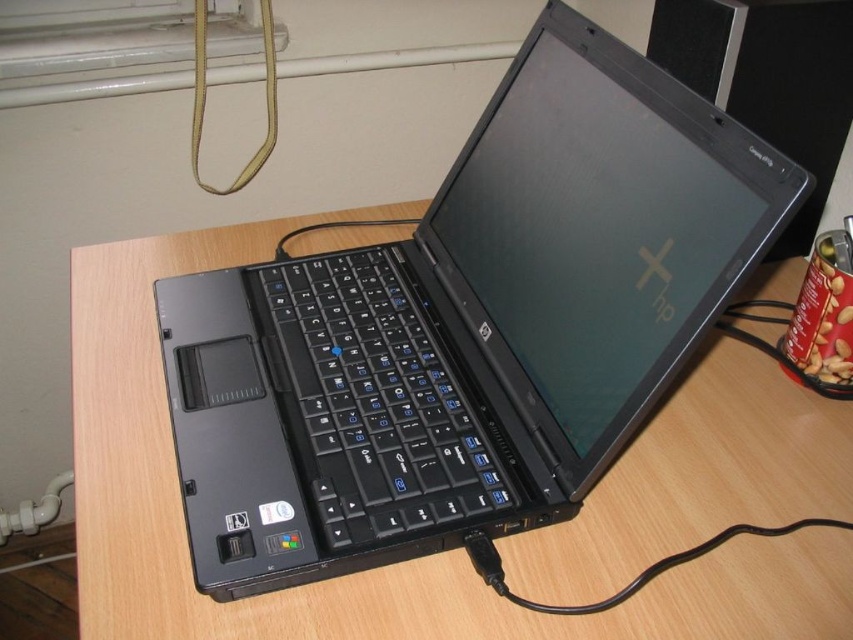
Who is more distant from viewer, (374, 316) or (322, 451)?

Positioned behind is point (374, 316).

Can you confirm if black plastic laptop at center is positioned to the right of black plastic keyboard at center?

Indeed, black plastic laptop at center is positioned on the right side of black plastic keyboard at center.

Between point (254, 483) and point (395, 314), which one is positioned behind?

The point (395, 314) is more distant.

At what (x,y) coordinates should I click in order to perform the action: click on black plastic laptop at center. Please return your answer as a coordinate pair (x, y). This screenshot has width=853, height=640. Looking at the image, I should click on (468, 326).